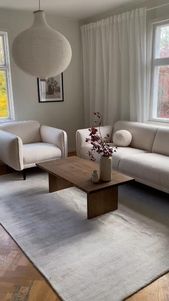
Find the location of a particular element. This screenshot has width=169, height=301. area rug is located at coordinates (133, 255).